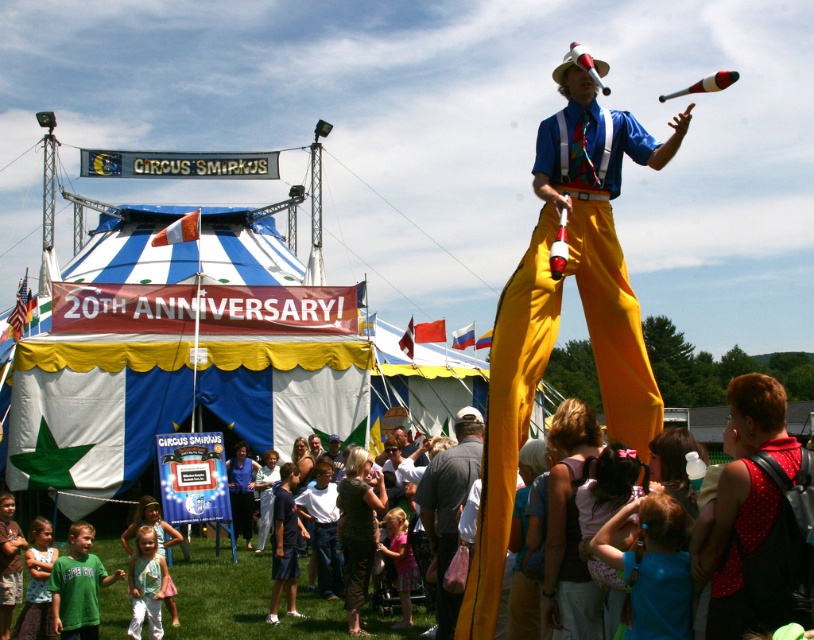
Can you confirm if green cotton shirt at lower left is taller than light pink fabric dress at lower center?

No, green cotton shirt at lower left is not taller than light pink fabric dress at lower center.

The height and width of the screenshot is (640, 814). Find the location of `green cotton shirt at lower left`. green cotton shirt at lower left is located at coordinates (77, 586).

Where is `green cotton shirt at lower left`? green cotton shirt at lower left is located at coordinates (77, 586).

Based on the photo, between blue fabric dress at center and light blue cotton dress at lower left, which one is positioned higher?

blue fabric dress at center is above.

Measure the distance between blue fabric dress at center and light blue cotton dress at lower left.

The distance of blue fabric dress at center from light blue cotton dress at lower left is 40.42 meters.

The height and width of the screenshot is (640, 814). Describe the element at coordinates (651, 566) in the screenshot. I see `blue fabric dress at center` at that location.

Find the location of a particular element. Image resolution: width=814 pixels, height=640 pixels. blue fabric dress at center is located at coordinates (651, 566).

How much distance is there between green cotton shirt at lower left and light blue cotton dress at lower left?

A distance of 6.88 feet exists between green cotton shirt at lower left and light blue cotton dress at lower left.

Is green cotton shirt at lower left taller than light blue cotton dress at lower left?

Incorrect, green cotton shirt at lower left's height is not larger of light blue cotton dress at lower left's.

Between point (103, 579) and point (55, 552), which one is positioned in front?

Point (103, 579)

The width and height of the screenshot is (814, 640). I want to click on green cotton shirt at lower left, so click(77, 586).